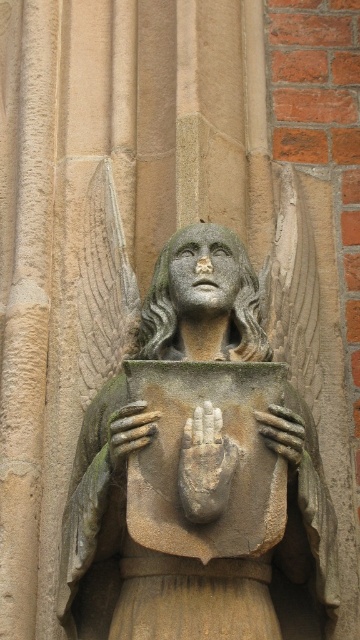
Question: Does stone statue at center have a larger size compared to smooth stone hand at center?

Choices:
 (A) yes
 (B) no

Answer: (A)

Question: In this image, where is stone statue at center located relative to smooth stone hand at center?

Choices:
 (A) right
 (B) left

Answer: (A)

Question: Does smooth stone hand at center have a lesser width compared to stone textured hand at center?

Choices:
 (A) no
 (B) yes

Answer: (A)

Question: Estimate the real-world distances between objects in this image. Which object is farther from the smooth stone hand at center?

Choices:
 (A) stone statue at center
 (B) stone textured hand at center

Answer: (B)

Question: Which point is closer to the camera taking this photo?

Choices:
 (A) (154, 416)
 (B) (302, 445)

Answer: (A)

Question: Which object appears farthest from the camera in this image?

Choices:
 (A) stone statue at center
 (B) smooth stone hand at center
 (C) stone textured hand at center

Answer: (C)